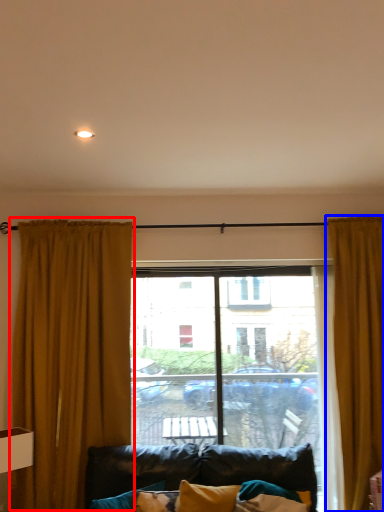
Question: Which object appears farthest to the camera in this image, curtain (highlighted by a red box) or curtain (highlighted by a blue box)?

Choices:
 (A) curtain
 (B) curtain

Answer: (A)